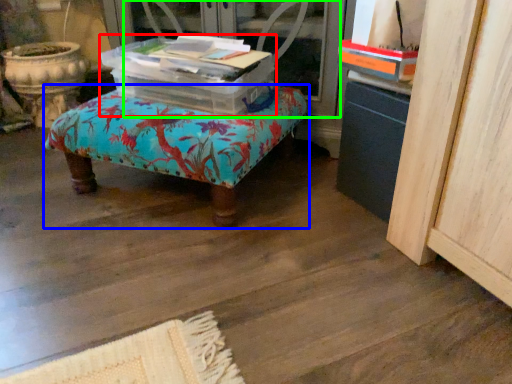
Question: Estimate the real-world distances between objects in this image. Which object is closer to storage box (highlighted by a red box), furniture (highlighted by a blue box) or screen door (highlighted by a green box)?

Choices:
 (A) furniture
 (B) screen door

Answer: (A)